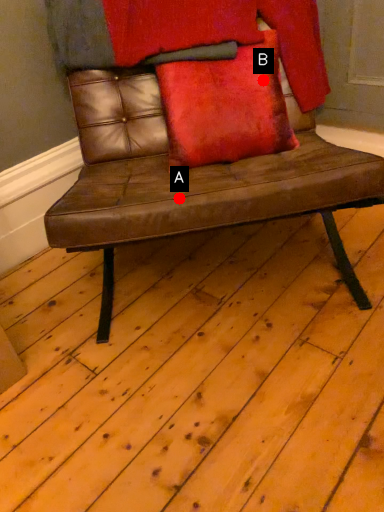
Question: Two points are circled on the image, labeled by A and B beside each circle. Which point appears farthest from the camera in this image?

Choices:
 (A) A is further
 (B) B is further

Answer: (B)